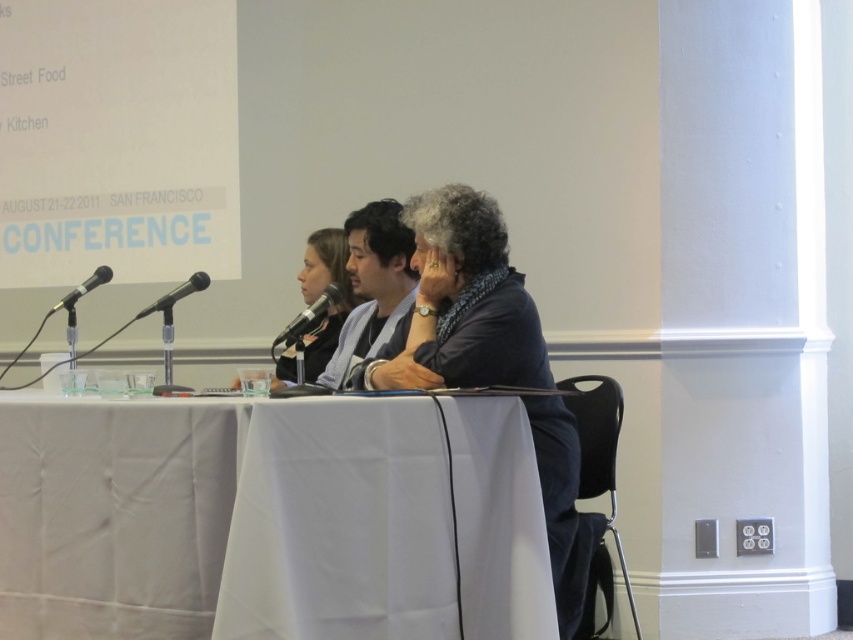
You are a photographer at the conference and need to position yourself to capture a clear shot of the white cloth covered table at center. Given that you are standing at point (225, 518), which is where the table is located, can you confirm if you are already at the correct position?

Yes, you are already at the correct position because the white cloth covered table at center is located at point (225, 518).